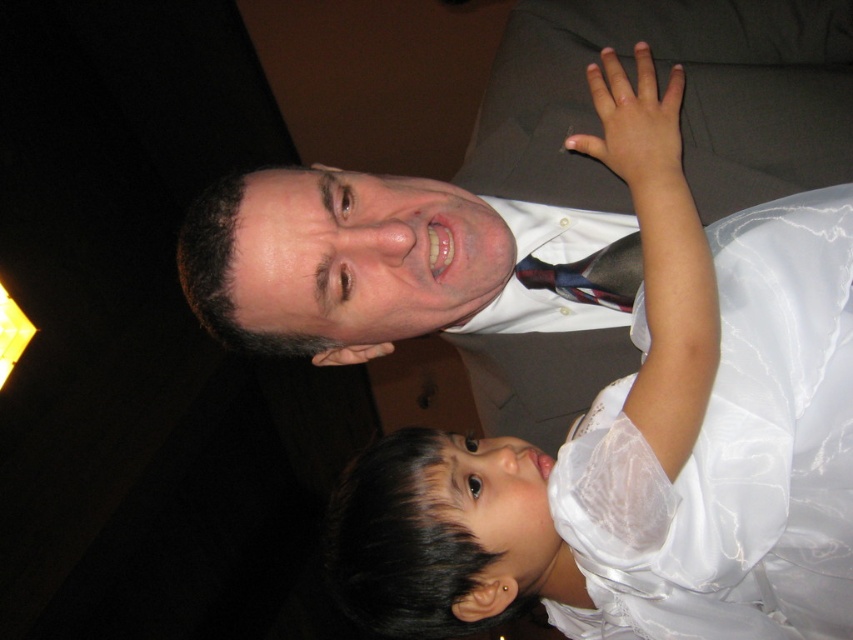
Can you confirm if white satin dress at center is thinner than white satin dress at upper right?

In fact, white satin dress at center might be wider than white satin dress at upper right.

Is white satin dress at center to the left of white satin dress at upper right from the viewer's perspective?

Indeed, white satin dress at center is positioned on the left side of white satin dress at upper right.

Between point (523, 465) and point (821, 305), which one is positioned behind?

Positioned behind is point (523, 465).

Identify the location of white satin dress at center. This screenshot has height=640, width=853. (646, 440).

Is white satin dress at center behind multicolored woven tie at center?

No, it is in front of multicolored woven tie at center.

Is white satin dress at center to the right of multicolored woven tie at center from the viewer's perspective?

Correct, you'll find white satin dress at center to the right of multicolored woven tie at center.

Who is more forward, (517, 483) or (624, 292)?

Positioned in front is point (517, 483).

Locate an element on the screen. This screenshot has height=640, width=853. white satin dress at center is located at coordinates (646, 440).

Is white satin dress at upper right thinner than multicolored woven tie at center?

No, white satin dress at upper right is not thinner than multicolored woven tie at center.

Does white satin dress at upper right appear on the left side of multicolored woven tie at center?

In fact, white satin dress at upper right is to the right of multicolored woven tie at center.

Does point (706, 428) come behind point (590, 257)?

No.

Find the location of a particular element. Image resolution: width=853 pixels, height=640 pixels. white satin dress at upper right is located at coordinates (730, 456).